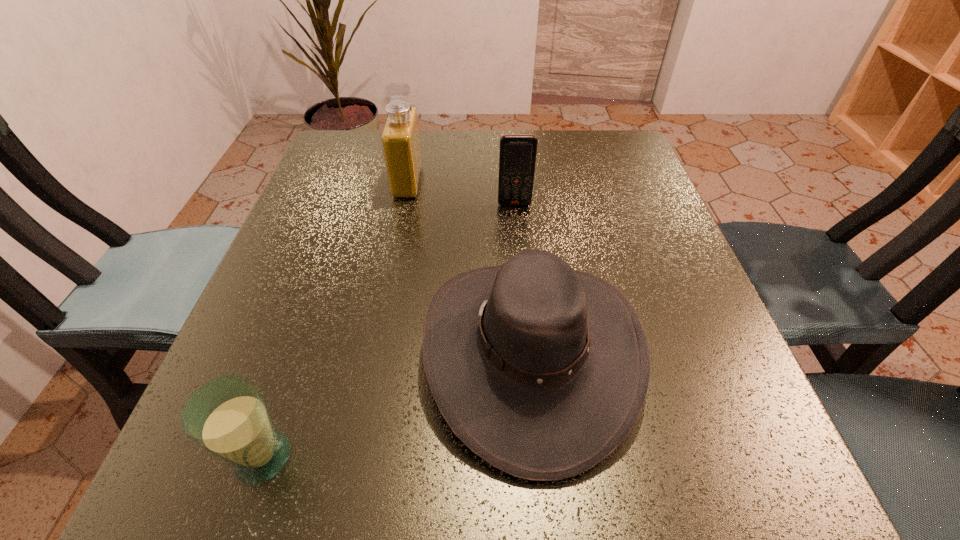
Where is `free point between the second farthest object and the leftmost object`? free point between the second farthest object and the leftmost object is located at coordinates (389, 330).

Locate an element on the screen. vacant space that is in between the perfume and the second farthest object is located at coordinates (461, 193).

The height and width of the screenshot is (540, 960). Identify the location of free space between the cellular telephone and the tallest object. (461, 193).

I want to click on empty space between the cowboy hat and the third object from right to left, so click(469, 267).

In order to click on object that stands as the second closest to the cellular telephone in this screenshot , I will do `click(541, 370)`.

Locate an element on the screen. This screenshot has height=540, width=960. object that is the closest to the glass is located at coordinates (541, 370).

Find the location of a particular element. The width and height of the screenshot is (960, 540). free spot that satisfies the following two spatial constraints: 1. on the front-facing side of the tallest object; 2. on the front side of the glass is located at coordinates tap(353, 457).